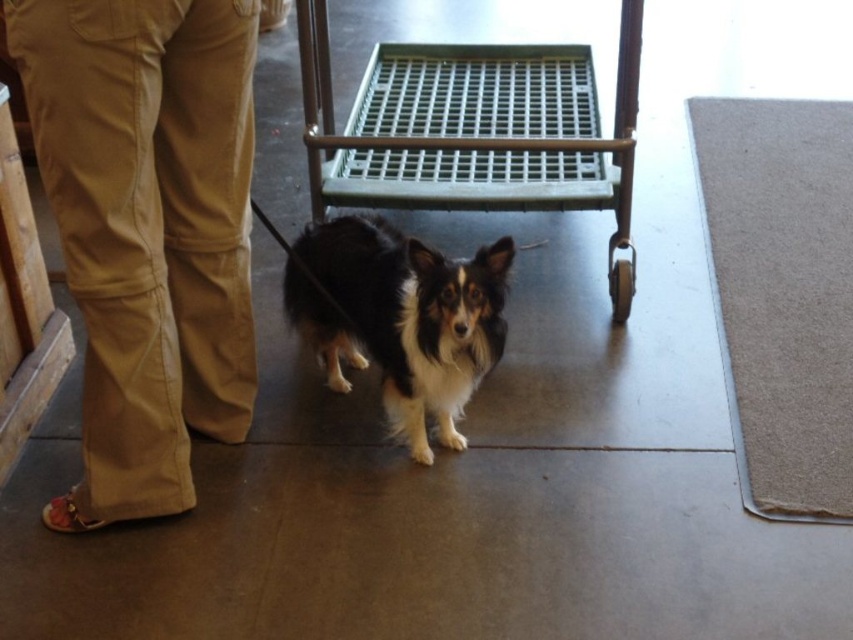
Question: Which of the following is the closest to the observer?

Choices:
 (A) black and white fur dog at center
 (B) metallic grid cart at center
 (C) tan cotton pants at lower left

Answer: (C)

Question: Is tan cotton pants at lower left to the left of metallic grid cart at center from the viewer's perspective?

Choices:
 (A) no
 (B) yes

Answer: (B)

Question: Does tan cotton pants at lower left come behind black and white fur dog at center?

Choices:
 (A) yes
 (B) no

Answer: (B)

Question: Which point is farther from the camera taking this photo?

Choices:
 (A) (466, 260)
 (B) (183, 296)
 (C) (625, 214)

Answer: (C)

Question: Based on their relative distances, which object is nearer to the metallic grid cart at center?

Choices:
 (A) tan cotton pants at lower left
 (B) black and white fur dog at center

Answer: (B)

Question: Observing the image, what is the correct spatial positioning of metallic grid cart at center in reference to black and white fur dog at center?

Choices:
 (A) below
 (B) above

Answer: (B)